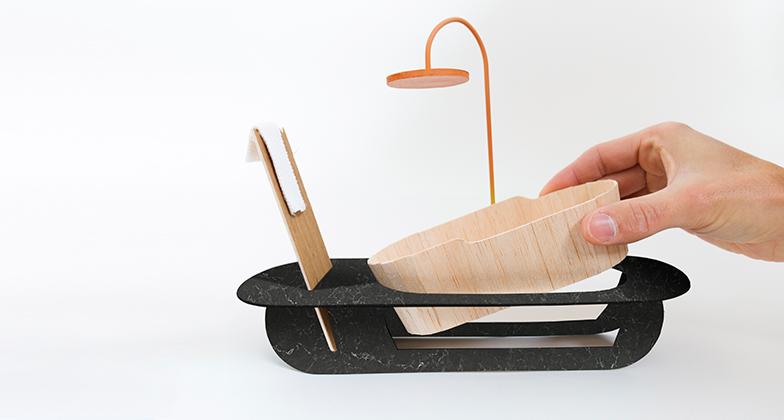
The height and width of the screenshot is (420, 784). I want to click on marble bath lining, so click(x=266, y=297).